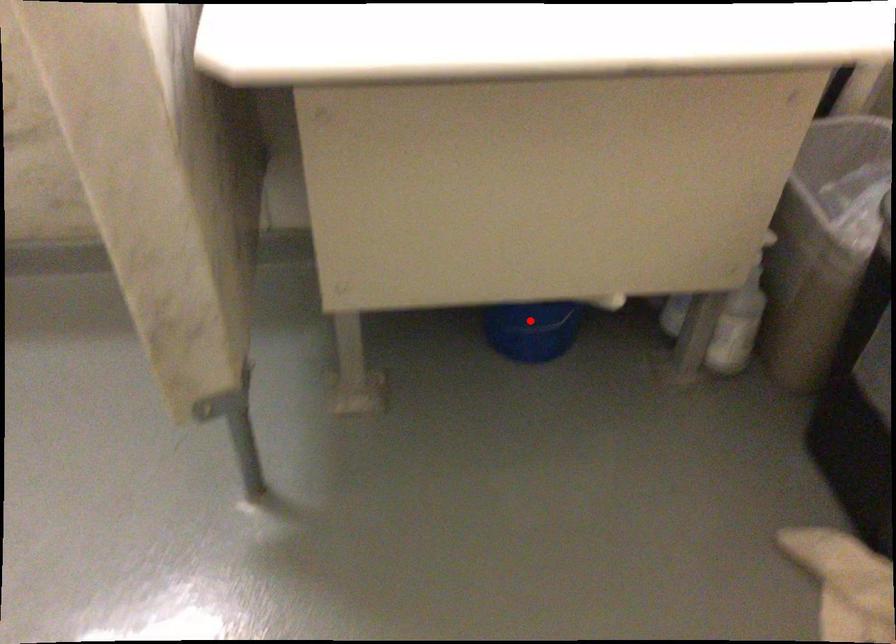
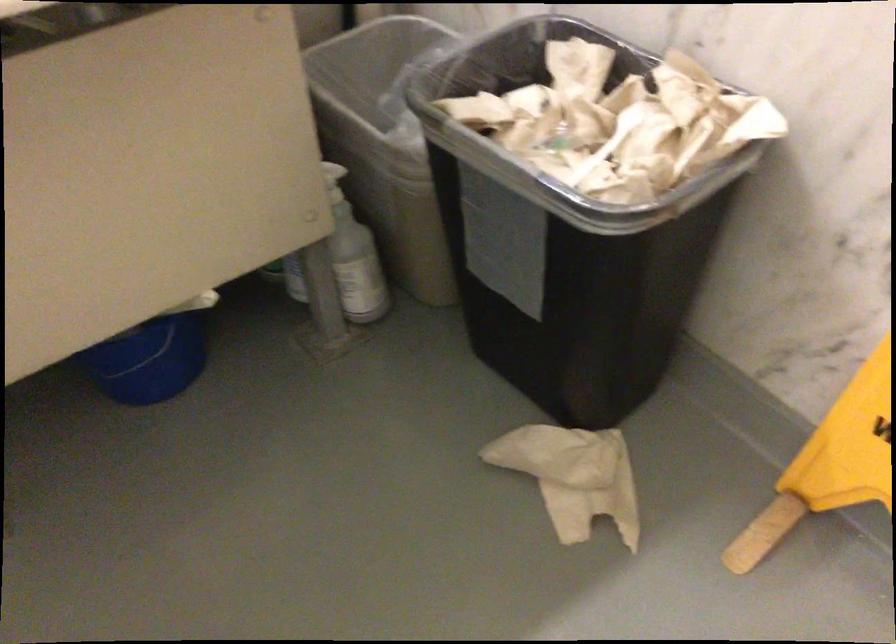
In the second image, find the point that corresponds to the highlighted location in the first image.

(149, 361)